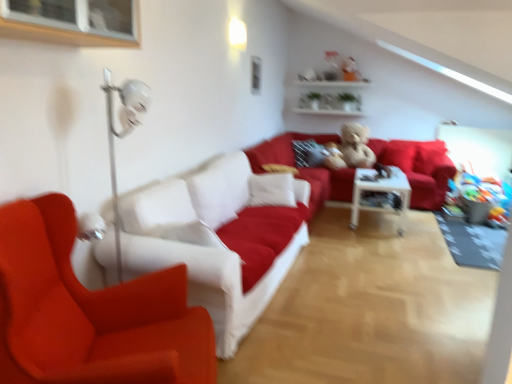
This screenshot has width=512, height=384. I want to click on velvet red pillow at center, so click(x=309, y=153).

Describe the element at coordinates (93, 310) in the screenshot. I see `matte red chair at left` at that location.

Describe the element at coordinates (73, 21) in the screenshot. I see `clear glass window at upper left` at that location.

Describe the element at coordinates (352, 149) in the screenshot. The image size is (512, 384). I see `fluffy beige teddy bear at center` at that location.

The image size is (512, 384). I want to click on white fabric couch at center, positioned as the second studio couch in back-to-front order, so click(215, 244).

How much space does velvet red couch at center, which appears as the second studio couch when viewed from the left, occupy vertically?

velvet red couch at center, which appears as the second studio couch when viewed from the left, is 34.53 inches in height.

Measure the distance between white glossy table at center and camera.

The distance of white glossy table at center from camera is 4.49 meters.

The image size is (512, 384). Identify the location of velvet red pillow at center. (309, 153).

This screenshot has height=384, width=512. In order to click on chair in front of the clear glass window at upper left in this screenshot , I will do `click(93, 310)`.

Is matte red chair at left wider than clear glass window at upper left?

Yes, matte red chair at left is wider than clear glass window at upper left.

Would you say matte red chair at left contains clear glass window at upper left?

Actually, clear glass window at upper left is outside matte red chair at left.

Considering the relative positions of matte red chair at left and clear glass window at upper left in the image provided, is matte red chair at left to the left of clear glass window at upper left from the viewer's perspective?

No.

Which is in front, point (69, 288) or point (313, 113)?

Point (69, 288)

The image size is (512, 384). In order to click on chair located in front of the white glossy shelves at upper center in this screenshot , I will do `click(93, 310)`.

In the scene shown: Looking at their sizes, would you say matte red chair at left is wider or thinner than white glossy shelves at upper center?

Clearly, matte red chair at left has more width compared to white glossy shelves at upper center.

Which of these two, clear glass window at upper left or white fabric couch at center, arranged as the second studio couch when viewed from the right, is bigger?

With larger size is white fabric couch at center, arranged as the second studio couch when viewed from the right.

Can you confirm if clear glass window at upper left is wider than white fabric couch at center, arranged as the second studio couch when viewed from the right?

No, clear glass window at upper left is not wider than white fabric couch at center, arranged as the second studio couch when viewed from the right.

Is clear glass window at upper left outside of white fabric couch at center, the 1th studio couch when ordered from left to right?

clear glass window at upper left lies outside white fabric couch at center, the 1th studio couch when ordered from left to right,'s area.

Can you confirm if clear glass window at upper left is shorter than white fabric couch at center, the 1th studio couch when ordered from left to right?

Correct, clear glass window at upper left is not as tall as white fabric couch at center, the 1th studio couch when ordered from left to right.

In the scene shown: Between white fabric couch at center, arranged as the second studio couch when viewed from the right, and velvet red couch at center, positioned as the 1th studio couch in right-to-left order, which one has smaller size?

white fabric couch at center, arranged as the second studio couch when viewed from the right.

Is white fabric couch at center, arranged as the second studio couch when viewed from the right, spatially inside velvet red couch at center, which appears as the second studio couch when viewed from the left, or outside of it?

white fabric couch at center, arranged as the second studio couch when viewed from the right, cannot be found inside velvet red couch at center, which appears as the second studio couch when viewed from the left.

Considering the sizes of white fabric couch at center, the 1th studio couch when ordered from left to right, and velvet red couch at center, positioned as the 1th studio couch in right-to-left order, in the image, is white fabric couch at center, the 1th studio couch when ordered from left to right, taller or shorter than velvet red couch at center, positioned as the 1th studio couch in right-to-left order,?

white fabric couch at center, the 1th studio couch when ordered from left to right, is taller than velvet red couch at center, positioned as the 1th studio couch in right-to-left order.

Between white fabric couch at center, arranged as the second studio couch when viewed from the right, and clear glass window at upper left, which one has smaller width?

clear glass window at upper left.

Which is closer to the camera, [180,244] or [79,38]?

Point [180,244].

Considering the sizes of white fabric couch at center, arranged as the second studio couch when viewed from the right, and clear glass window at upper left in the image, is white fabric couch at center, arranged as the second studio couch when viewed from the right, taller or shorter than clear glass window at upper left?

Considering their sizes, white fabric couch at center, arranged as the second studio couch when viewed from the right, has more height than clear glass window at upper left.

Which is behind, white fabric couch at center, the first studio couch in the front-to-back sequence, or clear glass window at upper left?

Positioned behind is white fabric couch at center, the first studio couch in the front-to-back sequence.

Which is correct: clear glass window at upper left is inside white glossy shelves at upper center, or outside of it?

clear glass window at upper left is outside white glossy shelves at upper center.

Is point (22, 13) closer or farther from the camera than point (324, 93)?

Point (22, 13) appears to be closer to the viewer than point (324, 93).

Looking at their sizes, would you say clear glass window at upper left is wider or thinner than white glossy shelves at upper center?

Considering their sizes, clear glass window at upper left looks broader than white glossy shelves at upper center.

From the image's perspective, is clear glass window at upper left beneath white glossy shelves at upper center?

Yes, from the image's perspective, clear glass window at upper left is below white glossy shelves at upper center.

Who is shorter, white glossy shelves at upper center or fluffy beige teddy bear at center?

white glossy shelves at upper center is shorter.

Is fluffy beige teddy bear at center at the back of white glossy shelves at upper center?

That's not correct — white glossy shelves at upper center is not looking away from fluffy beige teddy bear at center.

From a real-world perspective, is white glossy shelves at upper center physically located above or below fluffy beige teddy bear at center?

white glossy shelves at upper center is situated higher than fluffy beige teddy bear at center in the real world.

Is fluffy beige teddy bear at center a part of white glossy shelves at upper center?

No.

I want to click on window on the left of matte red chair at left, so click(x=73, y=21).

Identify the location of chair located underneath the white glossy shelves at upper center (from a real-world perspective). The image size is (512, 384). (93, 310).

From the image, which object appears to be nearer to clear glass window at upper left, fluffy beige teddy bear at center or velvet red couch at center, positioned as the 1th studio couch in right-to-left order?

velvet red couch at center, positioned as the 1th studio couch in right-to-left order, is closer to clear glass window at upper left.

Considering their positions, is matte red chair at left positioned further to white glossy table at center than white glossy shelves at upper center?

matte red chair at left is positioned further to the anchor white glossy table at center.

Which object lies nearer to the anchor point velvet red couch at center, which appears as the second studio couch when viewed from the left, white glossy table at center or white glossy shelves at upper center?

white glossy table at center is positioned closer to the anchor velvet red couch at center, which appears as the second studio couch when viewed from the left.

Estimate the real-world distances between objects in this image. Which object is further from velvet red couch at center, placed as the second studio couch when sorted from front to back, white fabric couch at center, positioned as the second studio couch in back-to-front order, or velvet red pillow at center?

Based on the image, white fabric couch at center, positioned as the second studio couch in back-to-front order, appears to be further to velvet red couch at center, placed as the second studio couch when sorted from front to back.

Based on their spatial positions, is clear glass window at upper left or white fabric couch at center, the first studio couch in the front-to-back sequence, further from velvet red couch at center, positioned as the 1th studio couch in right-to-left order?

The object further to velvet red couch at center, positioned as the 1th studio couch in right-to-left order, is clear glass window at upper left.

Based on their spatial positions, is fluffy beige teddy bear at center or white fabric couch at center, the first studio couch in the front-to-back sequence, further from clear glass window at upper left?

fluffy beige teddy bear at center.

Looking at the image, which one is located closer to velvet red pillow at center, fluffy beige teddy bear at center or matte red chair at left?

fluffy beige teddy bear at center.

Looking at this image, which object lies further to the anchor point fluffy beige teddy bear at center, white fabric couch at center, arranged as the second studio couch when viewed from the right, or matte red chair at left?

matte red chair at left is further to fluffy beige teddy bear at center.

Locate an element on the screen. The image size is (512, 384). figurine located between clear glass window at upper left and white glossy shelves at upper center in the depth direction is located at coordinates (352, 149).

Locate an element on the screen. studio couch between clear glass window at upper left and velvet red couch at center, placed as the second studio couch when sorted from front to back, along the z-axis is located at coordinates (215, 244).

Where is `table positioned between white fabric couch at center, the first studio couch in the front-to-back sequence, and velvet red pillow at center from near to far`? The height and width of the screenshot is (384, 512). table positioned between white fabric couch at center, the first studio couch in the front-to-back sequence, and velvet red pillow at center from near to far is located at coordinates (381, 191).

You are a GUI agent. You are given a task and a screenshot of the screen. Output one action in this format:
    pyautogui.click(x=<x>, y=<y>)
    Task: Click on the figurine between white fabric couch at center, positioned as the second studio couch in back-to-front order, and velvet red pillow at center from front to back
    The image size is (512, 384).
    Given the screenshot: What is the action you would take?
    pyautogui.click(x=352, y=149)